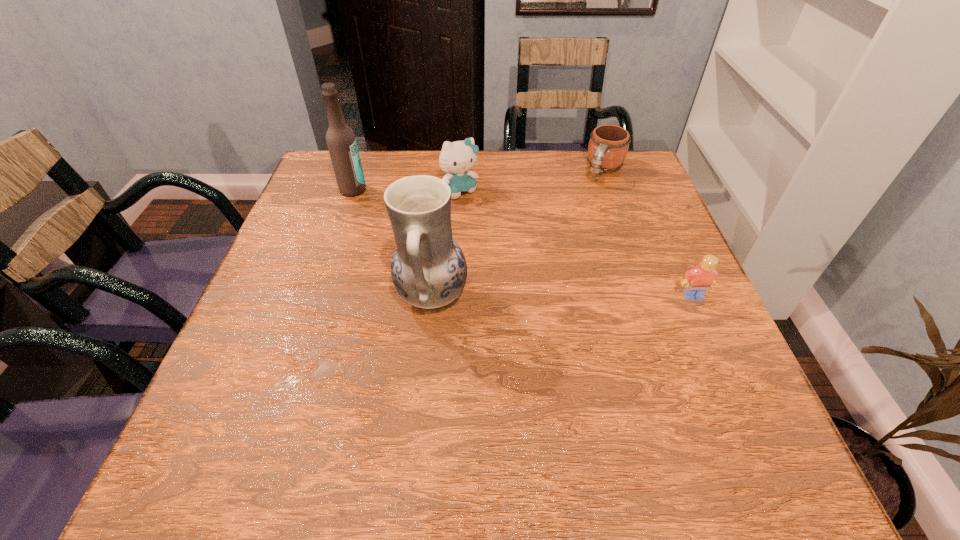
Where is `vacant space at the near right corner of the desktop`? vacant space at the near right corner of the desktop is located at coordinates (691, 375).

Locate an element on the screen. This screenshot has width=960, height=540. vacant area that lies between the pottery and the mug is located at coordinates (518, 233).

The width and height of the screenshot is (960, 540). I want to click on vacant area that lies between the Lego and the leftmost object, so click(523, 243).

Where is `empty location between the leftmost object and the mug`? The image size is (960, 540). empty location between the leftmost object and the mug is located at coordinates (479, 180).

Image resolution: width=960 pixels, height=540 pixels. What are the coordinates of `free area in between the Lego and the pottery` in the screenshot? It's located at (563, 296).

This screenshot has width=960, height=540. Identify the location of vacant space that is in between the leftmost object and the mug. (479, 180).

Where is `vacant region between the Lego and the beer bottle`? vacant region between the Lego and the beer bottle is located at coordinates (523, 243).

Where is `vacant area that lies between the Lego and the leftmost object`? vacant area that lies between the Lego and the leftmost object is located at coordinates (523, 243).

This screenshot has height=540, width=960. I want to click on object that is the second nearest to the mug, so click(x=697, y=281).

The image size is (960, 540). I want to click on object that ranks as the second closest to the kitten, so (428, 268).